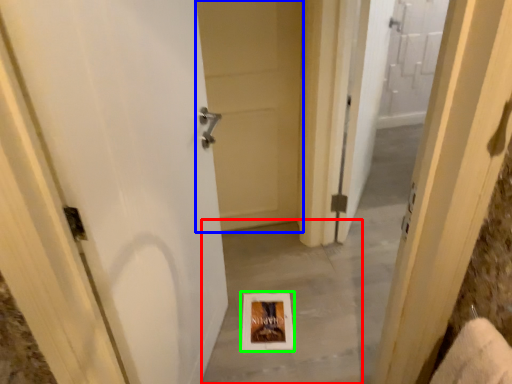
Question: Which object is the farthest from concrete (highlighted by a red box)? Choose among these: door (highlighted by a blue box) or picture frame (highlighted by a green box).

Choices:
 (A) door
 (B) picture frame

Answer: (A)